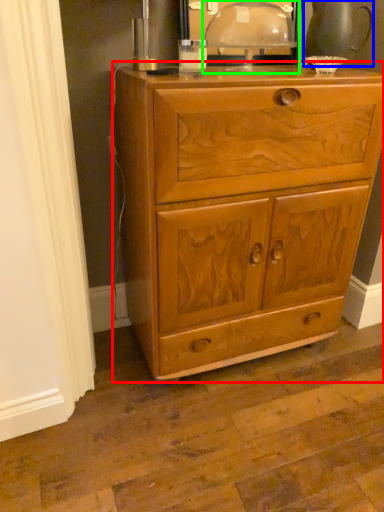
Question: Estimate the real-world distances between objects in this image. Which object is farther from chest of drawers (highlighted by a red box), tea pot (highlighted by a blue box) or table lamp (highlighted by a green box)?

Choices:
 (A) tea pot
 (B) table lamp

Answer: (A)